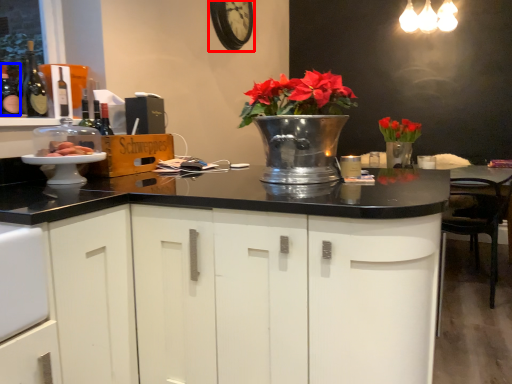
Question: Which object appears closest to the camera in this image, clock (highlighted by a red box) or bottle (highlighted by a blue box)?

Choices:
 (A) clock
 (B) bottle

Answer: (B)